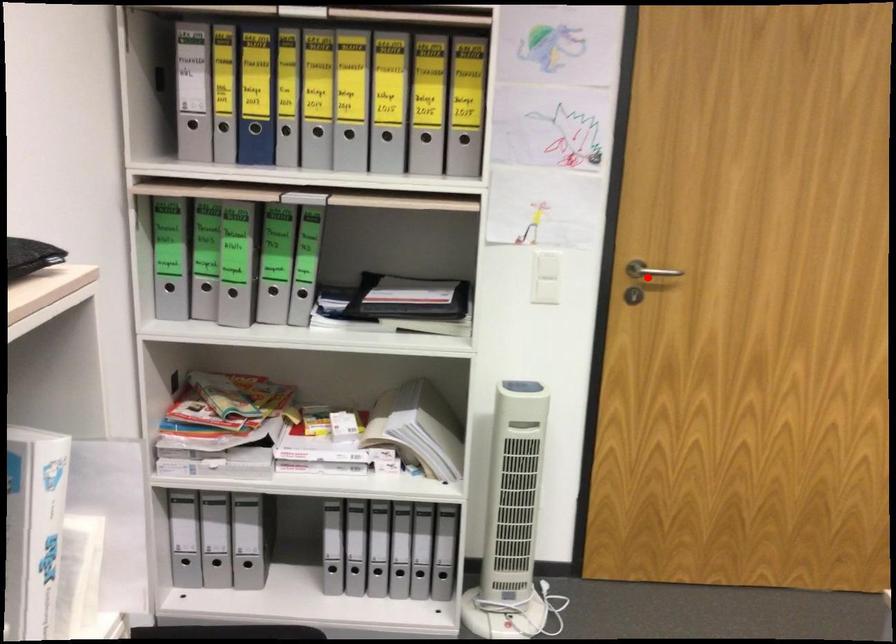
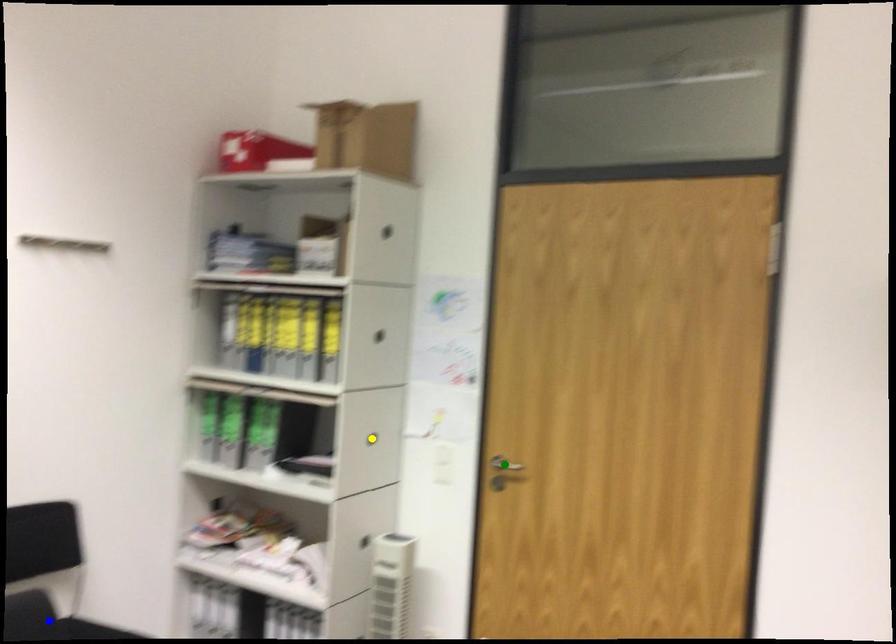
Question: I am providing you with two images of the same scene from different viewpoints. A red point is marked on the first image. You are given multiple points on the second image. In image 2, which mark is for the same physical point as the one in image 1?

Choices:
 (A) green point
 (B) blue point
 (C) yellow point

Answer: (A)